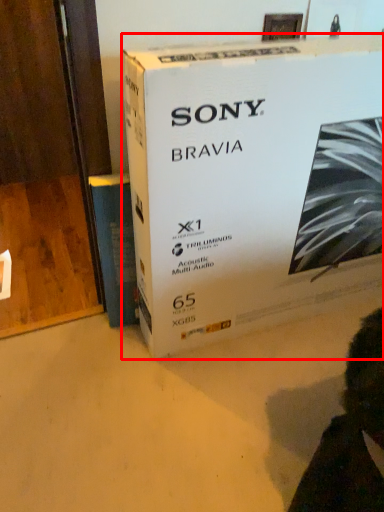
Question: In this image, where is box (annotated by the red box) located relative to paperback book?

Choices:
 (A) right
 (B) left

Answer: (A)